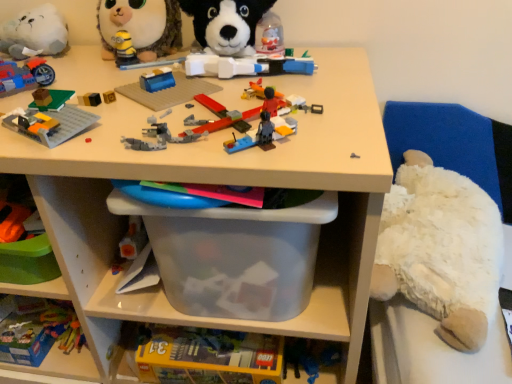
Locate an element on the screen. free space below translucent plastic airplane at center, arranged as the 3th toy when viewed from the right (from a real-world perspective) is located at coordinates (236, 116).